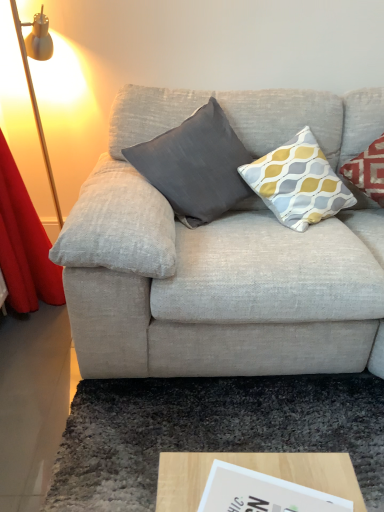
Question: Considering the relative sizes of dark gray fabric pillow at center, the 2th pillow from the right, and wooden at lower center in the image provided, is dark gray fabric pillow at center, the 2th pillow from the right, smaller than wooden at lower center?

Choices:
 (A) no
 (B) yes

Answer: (A)

Question: Is dark gray fabric pillow at center, the 2th pillow from the right, aimed at wooden at lower center?

Choices:
 (A) no
 (B) yes

Answer: (B)

Question: Is dark gray fabric pillow at center, the 2th pillow from the right, not near wooden at lower center?

Choices:
 (A) yes
 (B) no

Answer: (A)

Question: Is dark gray fabric pillow at center, the 1th pillow positioned from the left, positioned with its back to wooden at lower center?

Choices:
 (A) yes
 (B) no

Answer: (B)

Question: Can you confirm if dark gray fabric pillow at center, the 1th pillow positioned from the left, is taller than wooden at lower center?

Choices:
 (A) no
 (B) yes

Answer: (B)

Question: Based on their positions, is dark gray shaggy rug at lower center located to the left or right of dark gray fabric pillow at center, the 2th pillow from the right?

Choices:
 (A) left
 (B) right

Answer: (B)

Question: Considering the positions of dark gray shaggy rug at lower center and dark gray fabric pillow at center, the 1th pillow positioned from the left, in the image, is dark gray shaggy rug at lower center wider or thinner than dark gray fabric pillow at center, the 1th pillow positioned from the left,?

Choices:
 (A) wide
 (B) thin

Answer: (A)

Question: From a real-world perspective, is dark gray shaggy rug at lower center physically located above or below dark gray fabric pillow at center, the 2th pillow from the right?

Choices:
 (A) above
 (B) below

Answer: (B)

Question: Looking at the image, does dark gray shaggy rug at lower center seem bigger or smaller compared to dark gray fabric pillow at center, the 2th pillow from the right?

Choices:
 (A) big
 (B) small

Answer: (B)

Question: Does point (337, 190) appear closer or farther from the camera than point (196, 390)?

Choices:
 (A) farther
 (B) closer

Answer: (A)

Question: Based on their sizes in the image, would you say yellow-grey-patterned cushion at upper right, which is counted as the 1th pillow, starting from the right, is bigger or smaller than dark gray shaggy rug at lower center?

Choices:
 (A) big
 (B) small

Answer: (A)

Question: From a real-world perspective, relative to dark gray shaggy rug at lower center, is yellow-grey-patterned cushion at upper right, which is counted as the 1th pillow, starting from the right, vertically above or below?

Choices:
 (A) below
 (B) above

Answer: (B)

Question: From the image's perspective, is yellow-grey-patterned cushion at upper right, placed as the second pillow when sorted from left to right, positioned above or below dark gray shaggy rug at lower center?

Choices:
 (A) below
 (B) above

Answer: (B)

Question: Looking at the image, does wooden at lower center seem bigger or smaller compared to yellow-grey-patterned cushion at upper right, which is counted as the 1th pillow, starting from the right?

Choices:
 (A) big
 (B) small

Answer: (B)

Question: Would you say wooden at lower center is inside or outside yellow-grey-patterned cushion at upper right, placed as the second pillow when sorted from left to right?

Choices:
 (A) inside
 (B) outside

Answer: (B)